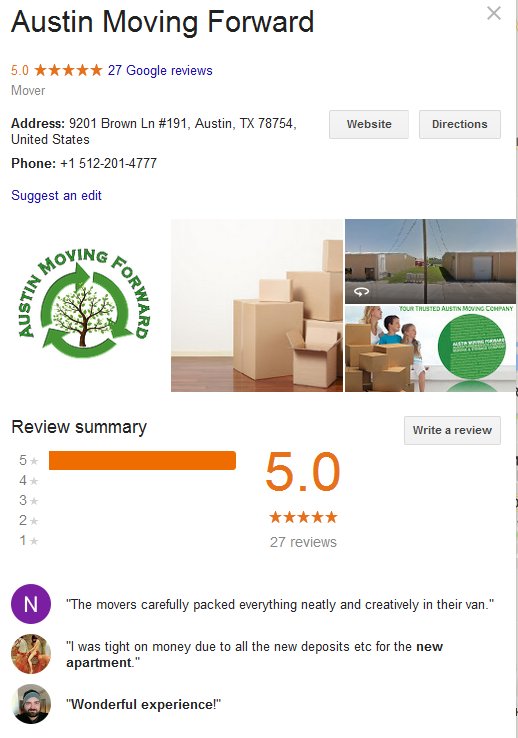
Find the location of a particular element. boxes is located at coordinates (387, 365), (266, 345).